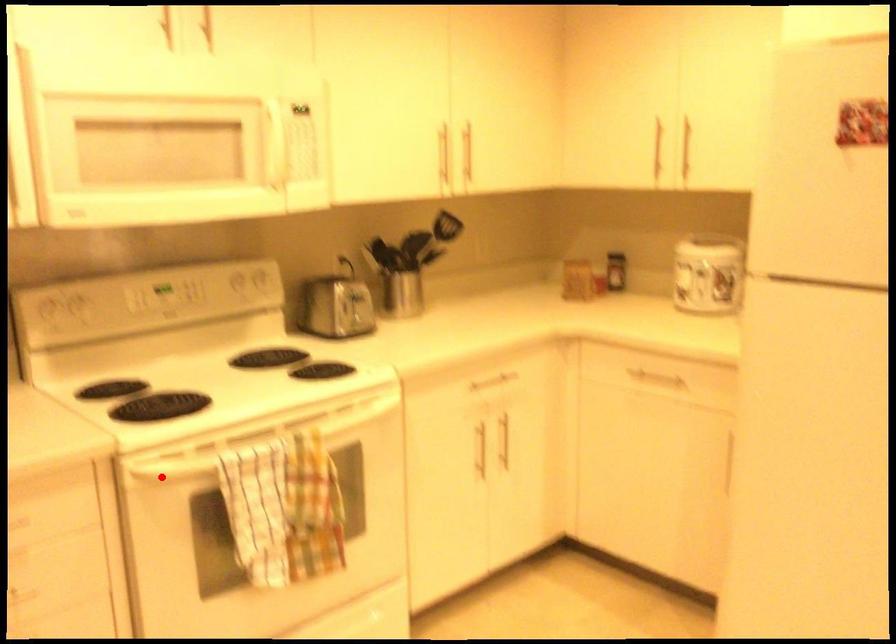
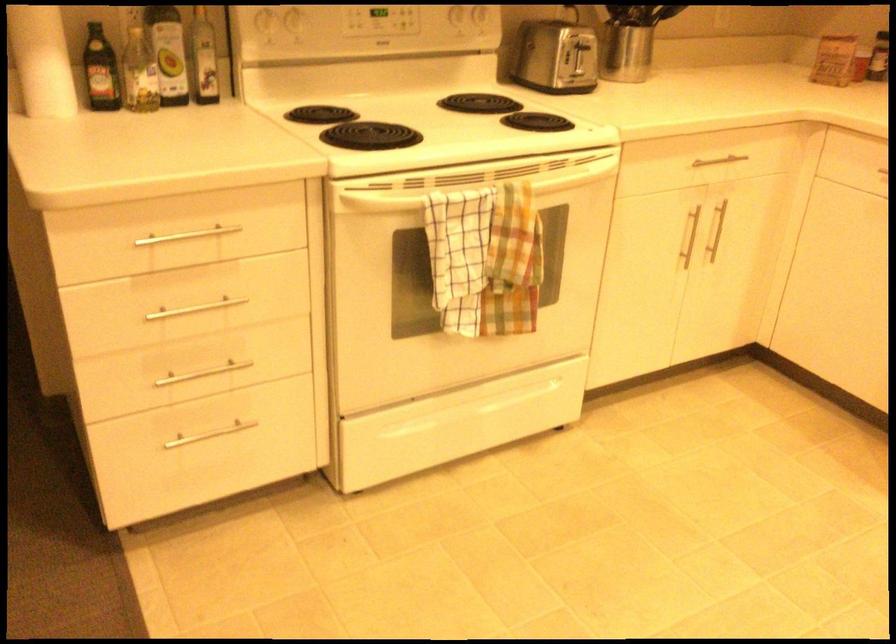
In the second image, find the point that corresponds to the highlighted location in the first image.

(374, 202)